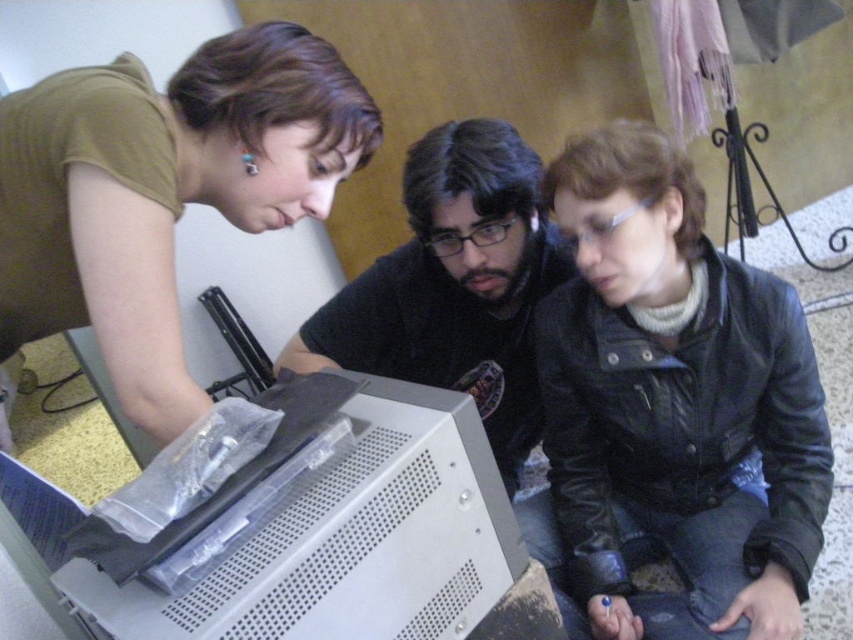
You are a delivery person who needs to place a rectangular box that is 1 meter wide on the table. The table has the black leather jacket at lower right and the matte black shirt at center. Can the box fit between them horizontally?

The black leather jacket at lower right is narrower than the matte black shirt at center. However, the exact distance between them isn not specified, so we cannot determine if the 1 meter wide box can fit between them horizontally.

You are standing at the table where the white plastic computer case at lower center is located. You need to reach for the black leather jacket at lower right to grab a tool from its pocket. In which direction should you move your hand to reach the jacket?

You should move your hand to the right to reach the black leather jacket at lower right, as it is positioned to the right of the white plastic computer case at lower center.

You are a delivery person who needs to place a small package between the black leather jacket at lower right and the matte black shirt at center. Can you fit the package in the space between them?

The black leather jacket at lower right is 10.91 inches away from the matte black shirt at center, so yes, the package can be placed between them as there is sufficient space.